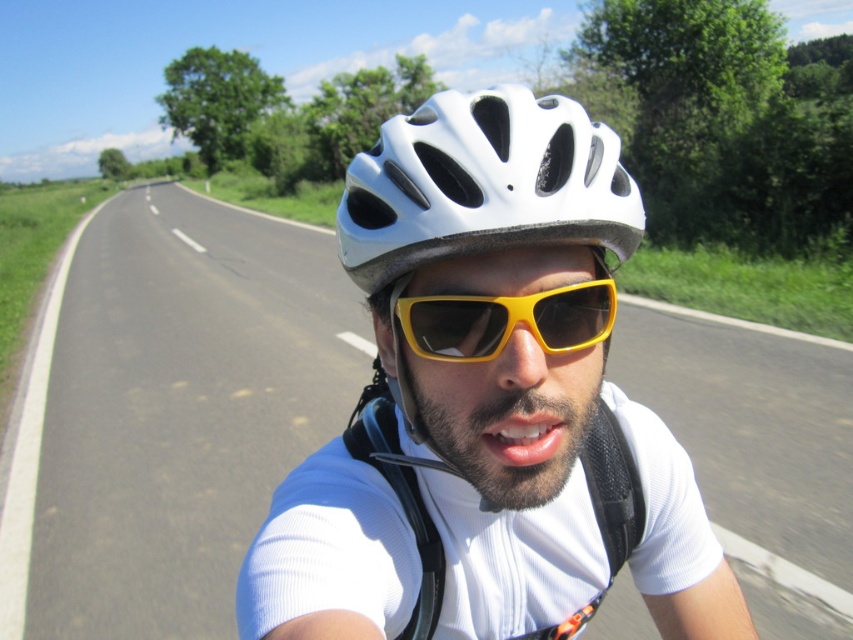
Question: Is white matte bicycle helmet at center in front of yellow matte/glossy goggles at center?

Choices:
 (A) yes
 (B) no

Answer: (A)

Question: Based on their relative distances, which object is nearer to the white matte bicycle helmet at center?

Choices:
 (A) white matte helmet at center
 (B) yellow matte/glossy goggles at center

Answer: (B)

Question: Considering the relative positions of white matte bicycle helmet at center and yellow matte/glossy goggles at center in the image provided, where is white matte bicycle helmet at center located with respect to yellow matte/glossy goggles at center?

Choices:
 (A) above
 (B) below

Answer: (A)

Question: Which object appears closest to the camera in this image?

Choices:
 (A) white matte bicycle helmet at center
 (B) yellow matte/glossy goggles at center

Answer: (A)

Question: Which object is positioned farthest from the white matte bicycle helmet at center?

Choices:
 (A) yellow matte/glossy goggles at center
 (B) white matte helmet at center

Answer: (B)

Question: Is white matte bicycle helmet at center to the left of yellow matte/glossy goggles at center from the viewer's perspective?

Choices:
 (A) yes
 (B) no

Answer: (A)